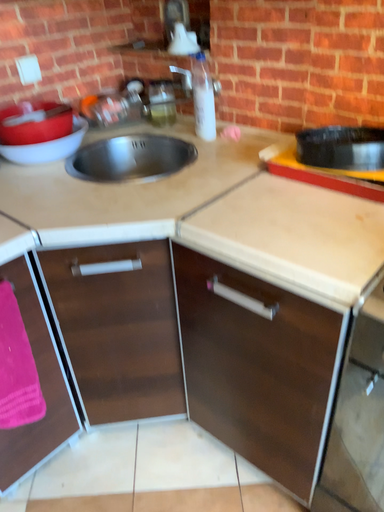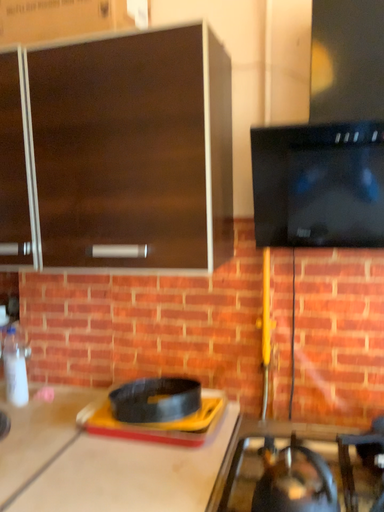
Question: How did the camera likely rotate when shooting the video?

Choices:
 (A) rotated left
 (B) rotated right

Answer: (B)